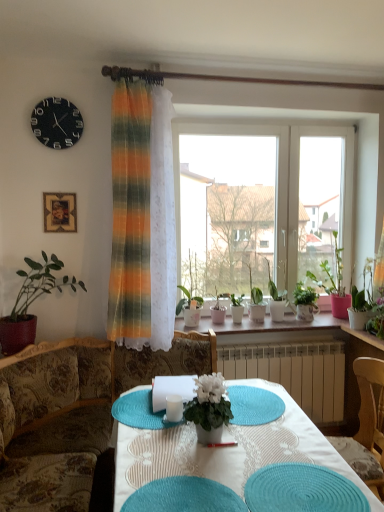
The height and width of the screenshot is (512, 384). Identify the location of free space underneath white matte flower pot at center, positioned as the 3th houseplant in left-to-right order (from a real-world perspective). (215, 437).